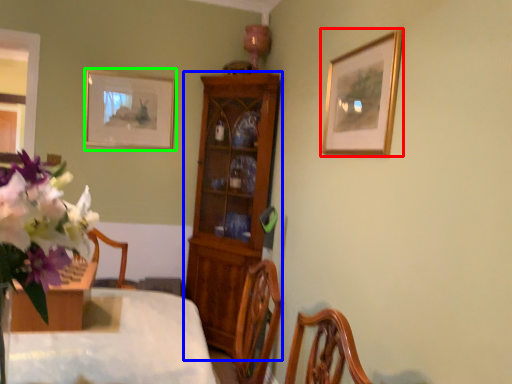
Question: Estimate the real-world distances between objects in this image. Which object is farther from picture frame (highlighted by a red box), cabinetry (highlighted by a blue box) or picture frame (highlighted by a green box)?

Choices:
 (A) cabinetry
 (B) picture frame

Answer: (B)